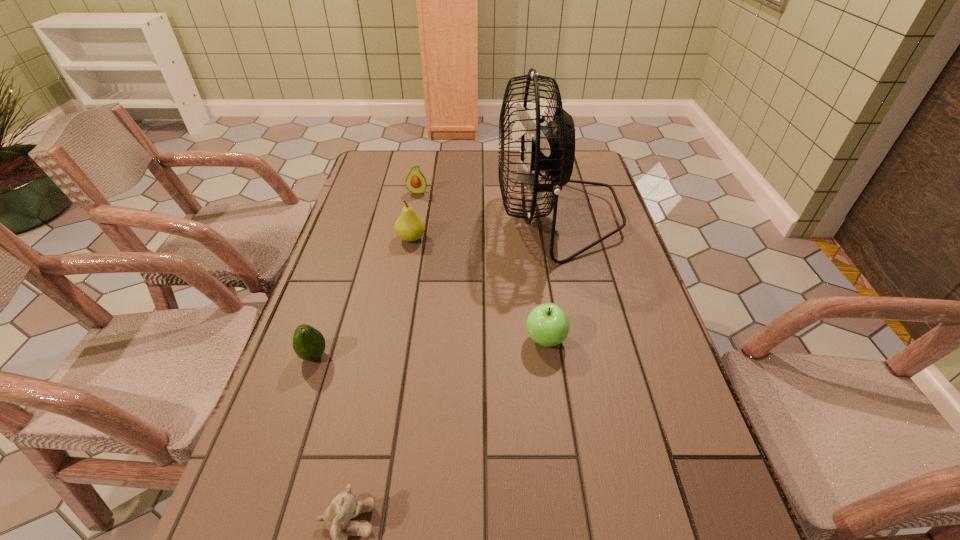
This screenshot has height=540, width=960. In the image, there is a desktop. Find the location of `free space at the far left corner`. free space at the far left corner is located at coordinates (365, 176).

You are a GUI agent. You are given a task and a screenshot of the screen. Output one action in this format:
    pyautogui.click(x=<x>, y=<y>)
    Task: Click on the blank space at the far right corner of the desktop
    This screenshot has width=960, height=540.
    Given the screenshot: What is the action you would take?
    pyautogui.click(x=583, y=159)

At what (x,y) coordinates should I click in order to perform the action: click on free space between the leftmost object and the apple. Please return your answer as a coordinate pair (x, y). The width and height of the screenshot is (960, 540). Looking at the image, I should click on (430, 348).

Locate an element on the screen. The image size is (960, 540). free spot between the apple and the pear is located at coordinates (478, 289).

The height and width of the screenshot is (540, 960). Identify the location of free space between the apple and the left avocado. (430, 348).

At what (x,y) coordinates should I click in order to perform the action: click on vacant space that's between the pear and the tallest object. Please return your answer as a coordinate pair (x, y). Looking at the image, I should click on (484, 227).

Locate an element on the screen. The width and height of the screenshot is (960, 540). free space that is in between the fan and the right avocado is located at coordinates (487, 204).

This screenshot has width=960, height=540. Find the location of `vacant area between the nearer avocado and the second tallest object`. vacant area between the nearer avocado and the second tallest object is located at coordinates click(363, 297).

Identify the location of free spot between the nearer avocado and the apple. The height and width of the screenshot is (540, 960). [x=430, y=348].

You are a GUI agent. You are given a task and a screenshot of the screen. Output one action in this format:
    pyautogui.click(x=<x>, y=<y>)
    Task: Click on the fifth closest object to the right avocado
    
    Given the screenshot: What is the action you would take?
    pyautogui.click(x=344, y=506)